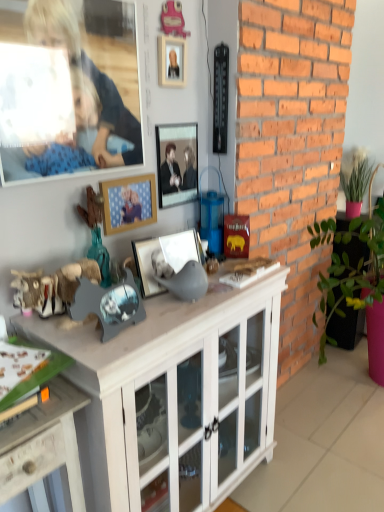
Question: From a real-world perspective, is metallic silver picture frame at center, placed as the first picture frame when sorted from top to bottom, under wooden desk at lower left?

Choices:
 (A) no
 (B) yes

Answer: (A)

Question: Is metallic silver picture frame at center, placed as the first picture frame when sorted from top to bottom, smaller than wooden desk at lower left?

Choices:
 (A) yes
 (B) no

Answer: (A)

Question: Does metallic silver picture frame at center, placed as the first picture frame when sorted from top to bottom, have a lesser width compared to wooden desk at lower left?

Choices:
 (A) yes
 (B) no

Answer: (A)

Question: Can you confirm if metallic silver picture frame at center, which is the third picture frame in bottom-to-top order, is bigger than wooden desk at lower left?

Choices:
 (A) no
 (B) yes

Answer: (A)

Question: Is metallic silver picture frame at center, which is the third picture frame in bottom-to-top order, shorter than wooden desk at lower left?

Choices:
 (A) yes
 (B) no

Answer: (A)

Question: Is metallic silver picture frame at center, placed as the first picture frame when sorted from top to bottom, beside wooden desk at lower left?

Choices:
 (A) yes
 (B) no

Answer: (B)

Question: Is smooth wooden frame at upper left positioned far away from metallic silver picture frame at center, which is the third picture frame in bottom-to-top order?

Choices:
 (A) no
 (B) yes

Answer: (A)

Question: From a real-world perspective, is smooth wooden frame at upper left on top of metallic silver picture frame at center, placed as the first picture frame when sorted from top to bottom?

Choices:
 (A) yes
 (B) no

Answer: (A)

Question: Considering the relative sizes of smooth wooden frame at upper left and metallic silver picture frame at center, placed as the first picture frame when sorted from top to bottom, in the image provided, is smooth wooden frame at upper left shorter than metallic silver picture frame at center, placed as the first picture frame when sorted from top to bottom,?

Choices:
 (A) no
 (B) yes

Answer: (A)

Question: From the image's perspective, is smooth wooden frame at upper left located beneath metallic silver picture frame at center, placed as the first picture frame when sorted from top to bottom?

Choices:
 (A) yes
 (B) no

Answer: (B)

Question: Does smooth wooden frame at upper left turn towards metallic silver picture frame at center, placed as the first picture frame when sorted from top to bottom?

Choices:
 (A) no
 (B) yes

Answer: (A)

Question: From a real-world perspective, is smooth wooden frame at upper left below metallic silver picture frame at center, which is the third picture frame in bottom-to-top order?

Choices:
 (A) yes
 (B) no

Answer: (B)

Question: Considering the relative sizes of white wood cabinet at center and wooden photo frame at center, arranged as the 2th picture frame when ordered from the bottom, in the image provided, is white wood cabinet at center smaller than wooden photo frame at center, arranged as the 2th picture frame when ordered from the bottom,?

Choices:
 (A) yes
 (B) no

Answer: (B)